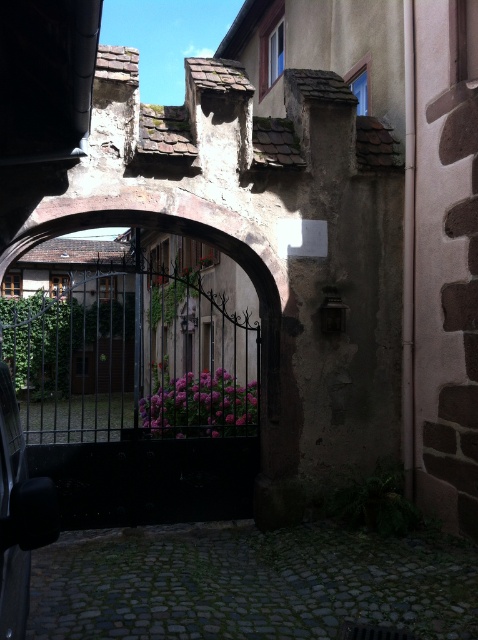
You are standing in the cobblestone alleyway and want to open the black wrought iron gate at center to enter the courtyard. If the gate is at coordinates 0.606, 0.341, where should you position yourself to push the gate open?

Since the black wrought iron gate at center is located at coordinates (162,387), you should position yourself near the gate at those coordinates to push it open effectively.

You are standing in the alleyway and want to walk through the black wrought iron gate at center to enter the courtyard. Which direction should you move relative to the gray cobblestone alley at lower center?

You should move to the left of the gray cobblestone alley at lower center because the black wrought iron gate at center is located to the left of it.